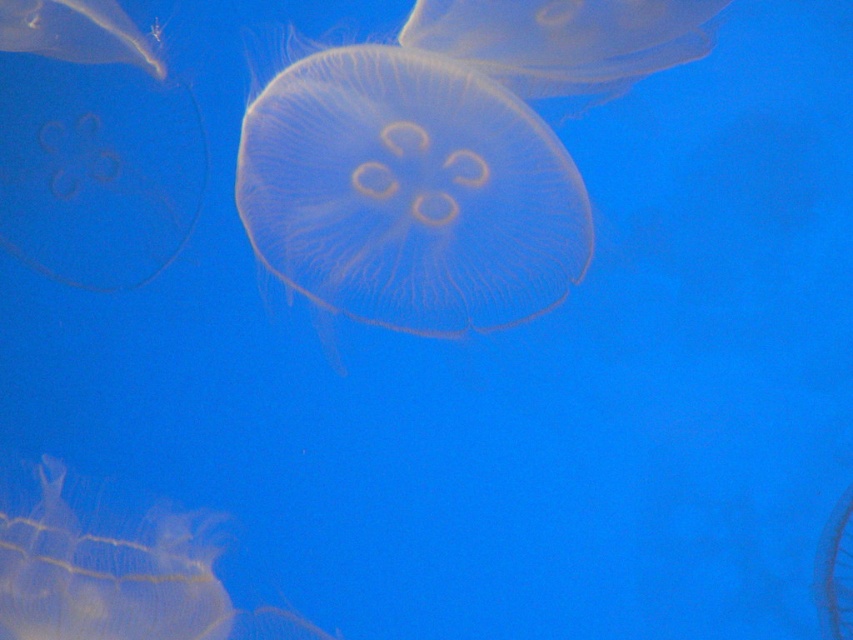
Is point (93, 35) less distant than point (99, 605)?

No.

Does transparent gelatinous at left have a larger size compared to translucent gelatinous at lower left?

Yes, transparent gelatinous at left is bigger than translucent gelatinous at lower left.

The image size is (853, 640). What do you see at coordinates (91, 145) in the screenshot?
I see `transparent gelatinous at left` at bounding box center [91, 145].

This screenshot has height=640, width=853. Find the location of `transparent gelatinous at left`. transparent gelatinous at left is located at coordinates (91, 145).

Can you confirm if translucent gelatinous at center is wider than transparent gelatinous at left?

Correct, the width of translucent gelatinous at center exceeds that of transparent gelatinous at left.

Is translucent gelatinous at center to the left of transparent gelatinous at left from the viewer's perspective?

No, translucent gelatinous at center is not to the left of transparent gelatinous at left.

Which is behind, point (440, 138) or point (62, 214)?

The point (62, 214) is more distant.

The image size is (853, 640). I want to click on translucent gelatinous at center, so click(409, 193).

Can you confirm if translucent gelatinous at lower left is bigger than transparent gelatinous at center?

Correct, translucent gelatinous at lower left is larger in size than transparent gelatinous at center.

Between translucent gelatinous at lower left and transparent gelatinous at center, which one is positioned higher?

transparent gelatinous at center is above.

Which is in front, point (287, 618) or point (589, 12)?

Point (589, 12) is in front.

The height and width of the screenshot is (640, 853). I want to click on translucent gelatinous at lower left, so click(115, 566).